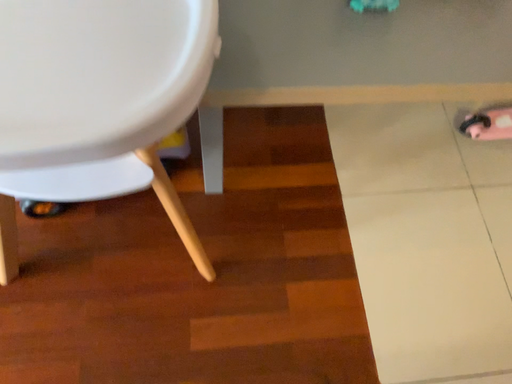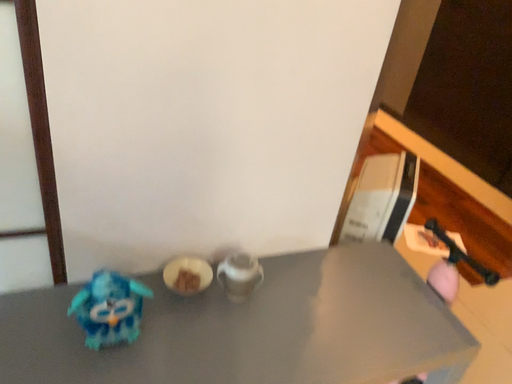
Question: How did the camera likely rotate when shooting the video?

Choices:
 (A) rotated left
 (B) rotated right

Answer: (B)